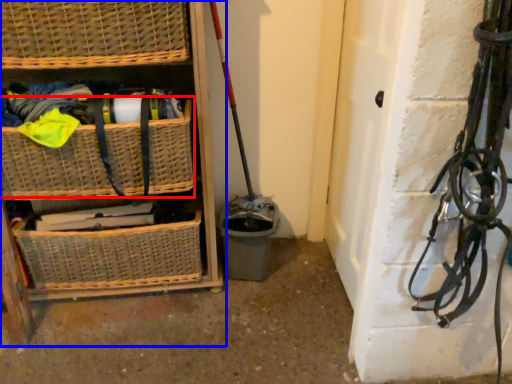
Question: Among these objects, which one is farthest to the camera, basket (highlighted by a red box) or shelf (highlighted by a blue box)?

Choices:
 (A) basket
 (B) shelf

Answer: (A)